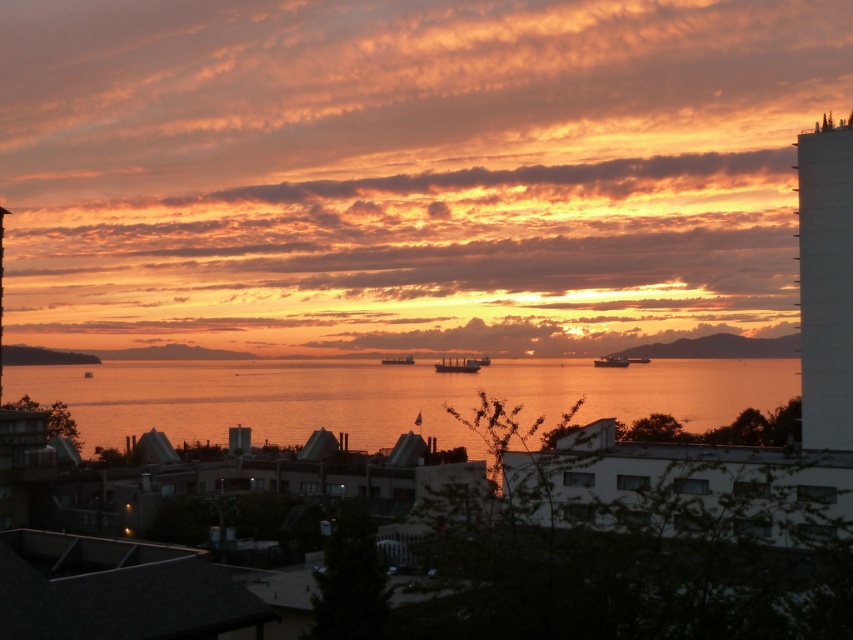
Does smooth concrete tower at upper left appear on the right side of metallic silver ship at center?

No, smooth concrete tower at upper left is not to the right of metallic silver ship at center.

Describe the element at coordinates (0, 291) in the screenshot. The width and height of the screenshot is (853, 640). I see `smooth concrete tower at upper left` at that location.

You are a GUI agent. You are given a task and a screenshot of the screen. Output one action in this format:
    pyautogui.click(x=<x>, y=<y>)
    Task: Click on the smooth concrete tower at upper left
    
    Given the screenshot: What is the action you would take?
    pyautogui.click(x=0, y=291)

Can you confirm if golden reflective water at center is positioned below metallic silver ship at center?

Yes, golden reflective water at center is below metallic silver ship at center.

Who is more forward, (380, 410) or (637, 356)?

Point (380, 410) is in front.

At what (x,y) coordinates should I click in order to perform the action: click on golden reflective water at center. Please return your answer as a coordinate pair (x, y). Looking at the image, I should click on (387, 396).

Locate an element on the screen. This screenshot has height=640, width=853. golden reflective water at center is located at coordinates (387, 396).

Is smooth concrete tower at upper left positioned before smooth metallic ship at center?

Yes, smooth concrete tower at upper left is closer to the viewer.

Does point (1, 356) come closer to viewer compared to point (393, 356)?

Yes, it is in front of point (393, 356).

Find the location of a particular element. The height and width of the screenshot is (640, 853). smooth concrete tower at upper left is located at coordinates (0, 291).